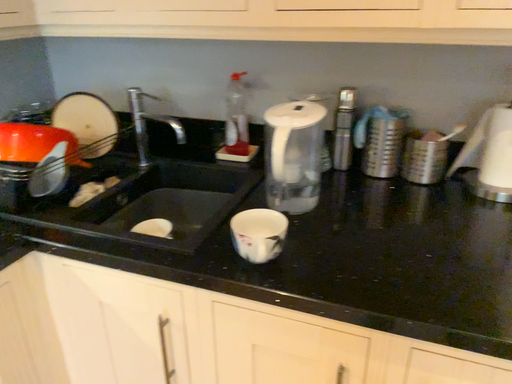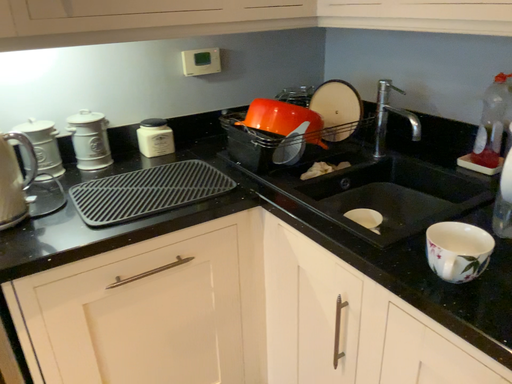
Question: How did the camera likely rotate when shooting the video?

Choices:
 (A) rotated right
 (B) rotated left

Answer: (B)